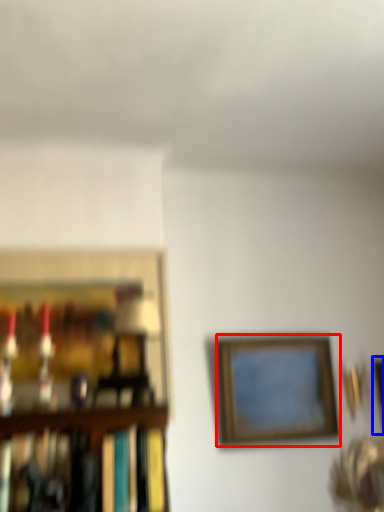
Question: Which point is closer to the camera, picture frame (highlighted by a red box) or picture frame (highlighted by a blue box)?

Choices:
 (A) picture frame
 (B) picture frame

Answer: (A)